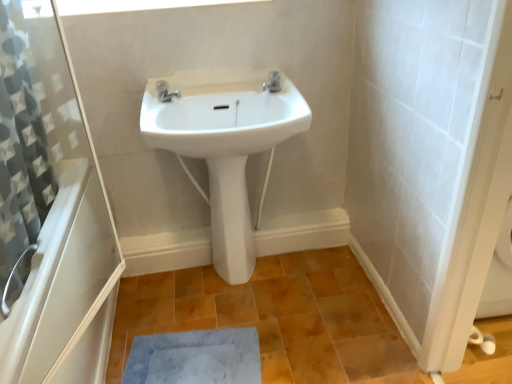
In order to click on free space on the front side of white glossy bidet at center in this screenshot , I will do `click(237, 306)`.